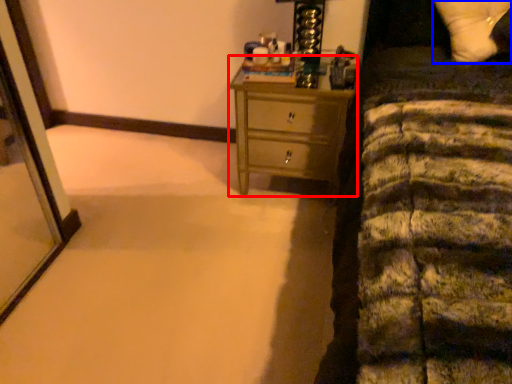
Question: Which object is further to the camera taking this photo, chest of drawers (highlighted by a red box) or pillow (highlighted by a blue box)?

Choices:
 (A) chest of drawers
 (B) pillow

Answer: (A)